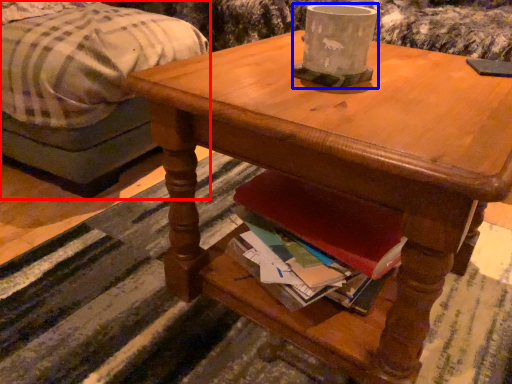
Question: Among these objects, which one is farthest to the camera, studio couch (highlighted by a red box) or coffee cup (highlighted by a blue box)?

Choices:
 (A) studio couch
 (B) coffee cup

Answer: (A)